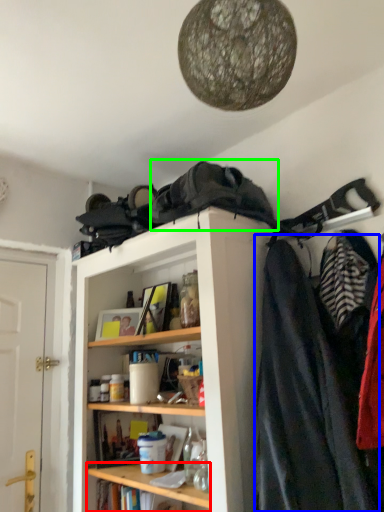
Question: Estimate the real-world distances between objects in this image. Which object is farther from cabinet (highlighted by a red box), cloak (highlighted by a blue box) or cloak (highlighted by a green box)?

Choices:
 (A) cloak
 (B) cloak

Answer: (B)